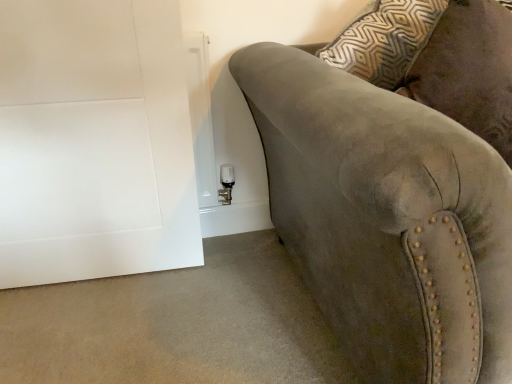
Question: In terms of width, does white matte door at lower left look wider or thinner when compared to suede couch at right?

Choices:
 (A) thin
 (B) wide

Answer: (A)

Question: Considering the relative positions of white matte door at lower left and suede couch at right in the image provided, is white matte door at lower left to the left or to the right of suede couch at right?

Choices:
 (A) right
 (B) left

Answer: (B)

Question: From a real-world perspective, is white matte door at lower left above or below suede couch at right?

Choices:
 (A) above
 (B) below

Answer: (A)

Question: Would you say suede couch at right is inside or outside white matte door at lower left?

Choices:
 (A) outside
 (B) inside

Answer: (A)

Question: In the image, is suede couch at right on the left side or the right side of white matte door at lower left?

Choices:
 (A) right
 (B) left

Answer: (A)

Question: From their relative heights in the image, would you say suede couch at right is taller or shorter than white matte door at lower left?

Choices:
 (A) tall
 (B) short

Answer: (B)

Question: From a real-world perspective, is suede couch at right physically located above or below white matte door at lower left?

Choices:
 (A) above
 (B) below

Answer: (B)